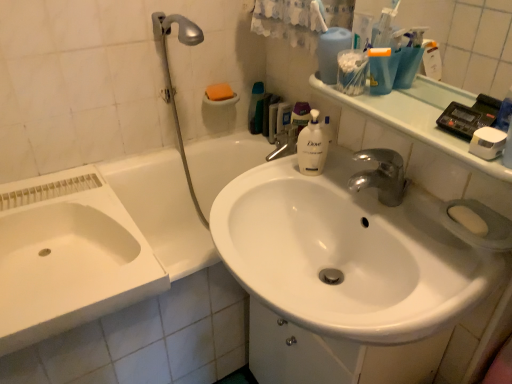
What do you see at coordinates (418, 116) in the screenshot? I see `white glossy sink at upper right` at bounding box center [418, 116].

In the scene shown: Measure the distance between white glossy sink at upper right and camera.

The distance of white glossy sink at upper right from camera is 69.15 centimeters.

What do you see at coordinates (170, 79) in the screenshot? The image size is (512, 384). I see `silver metallic shower head at upper left` at bounding box center [170, 79].

How much space does white glossy sink at lower left, which appears as the first sink when viewed from the left, occupy horizontally?

27.57 inches.

Describe the element at coordinates (68, 256) in the screenshot. I see `white glossy sink at lower left, which appears as the first sink when viewed from the left` at that location.

Where is `white fabric bath towel at upper center`? white fabric bath towel at upper center is located at coordinates (287, 22).

From the image's perspective, is white glossy sink at center, the 2th sink from the left, below orange sponge at upper center, the 1th soap positioned from the top?

Yes.

From a real-world perspective, is white glossy sink at center, arranged as the 1th sink when viewed from the right, under orange sponge at upper center, the first soap positioned from the left?

Correct, in the physical world, white glossy sink at center, arranged as the 1th sink when viewed from the right, is lower than orange sponge at upper center, the first soap positioned from the left.

Would you consider white glossy sink at upper right to be distant from white glossy bathtub at lower left?

No.

Considering the relative sizes of white glossy sink at upper right and white glossy bathtub at lower left in the image provided, is white glossy sink at upper right wider than white glossy bathtub at lower left?

Incorrect, the width of white glossy sink at upper right does not surpass that of white glossy bathtub at lower left.

Would you say white glossy sink at upper right is to the left or to the right of white glossy bathtub at lower left in the picture?

Based on their positions, white glossy sink at upper right is located to the right of white glossy bathtub at lower left.

From the picture: Is silver metallic shower head at upper left looking in the opposite direction of white glossy sink at center, the 2th sink from the left?

No, white glossy sink at center, the 2th sink from the left, is not at the back of silver metallic shower head at upper left.

Can you confirm if silver metallic shower head at upper left is positioned to the right of white glossy sink at center, arranged as the 1th sink when viewed from the right?

No.

Consider the image. In terms of height, does silver metallic shower head at upper left look taller or shorter compared to white glossy sink at center, the 2th sink from the left?

Considering their sizes, silver metallic shower head at upper left has more height than white glossy sink at center, the 2th sink from the left.

From a real-world perspective, which object rests below the other?

white glossy sink at center, arranged as the 1th sink when viewed from the right, is physically lower.

Considering the points (214, 97) and (478, 277), which point is in front, point (214, 97) or point (478, 277)?

The point (478, 277) is closer.

Is orange sponge at upper center, the first soap positioned from the left, placed right next to white glossy sink at center, arranged as the 1th sink when viewed from the right?

orange sponge at upper center, the first soap positioned from the left, is not next to white glossy sink at center, arranged as the 1th sink when viewed from the right, and they're not touching.

Is orange sponge at upper center, the second soap from the front, in front of white glossy sink at center, the 2th sink from the left?

No, the depth of orange sponge at upper center, the second soap from the front, is greater than that of white glossy sink at center, the 2th sink from the left.

Considering the relative sizes of silver metallic shower head at upper left and orange sponge at upper center, the 1th soap positioned from the top, in the image provided, is silver metallic shower head at upper left shorter than orange sponge at upper center, the 1th soap positioned from the top,?

No.

Is silver metallic shower head at upper left facing towards orange sponge at upper center, the second soap from the front?

No, silver metallic shower head at upper left is not aimed at orange sponge at upper center, the second soap from the front.

Where is `soap behind the silver metallic shower head at upper left`? soap behind the silver metallic shower head at upper left is located at coordinates (219, 92).

Considering the sizes of silver metallic shower head at upper left and orange sponge at upper center, the first soap positioned from the back, in the image, is silver metallic shower head at upper left wider or thinner than orange sponge at upper center, the first soap positioned from the back,?

In the image, silver metallic shower head at upper left appears to be wider than orange sponge at upper center, the first soap positioned from the back.

From a real-world perspective, which is physically above, white fabric bath towel at upper center or white glossy bathtub at lower left?

From a 3D spatial view, white fabric bath towel at upper center is above.

The height and width of the screenshot is (384, 512). What are the coordinates of `bath on the left of white fabric bath towel at upper center` in the screenshot? It's located at (115, 270).

Does white fabric bath towel at upper center have a lesser height compared to white glossy bathtub at lower left?

Indeed, white fabric bath towel at upper center has a lesser height compared to white glossy bathtub at lower left.

Is point (282, 32) closer or farther from the camera than point (152, 292)?

Clearly, point (282, 32) is more distant from the camera than point (152, 292).

From a real-world perspective, is white plastic toothbrush at upper center over clear plastic container at upper right?

Yes, from a real-world perspective, white plastic toothbrush at upper center is on top of clear plastic container at upper right.

Is white plastic toothbrush at upper center aimed at clear plastic container at upper right?

No, white plastic toothbrush at upper center does not turn towards clear plastic container at upper right.

The height and width of the screenshot is (384, 512). Identify the location of mouthwash below the white plastic toothbrush at upper center (from a real-world perspective). (351, 71).

Which object is positioned more to the left, white plastic toothbrush at upper center or clear plastic container at upper right?

white plastic toothbrush at upper center is more to the left.

Locate an element on the screen. This screenshot has height=384, width=512. sink on the right of orange sponge at upper center, which ranks as the second soap in bottom-to-top order is located at coordinates point(348,253).

Locate an element on the screen. The image size is (512, 384). counter top in front of the white glossy bathtub at lower left is located at coordinates (418, 116).

From the picture: Based on their spatial positions, is silver metallic shower head at upper left or orange sponge at upper center, which is the second soap from right to left, further from white glossy bathtub at lower left?

orange sponge at upper center, which is the second soap from right to left.

From the image, which object appears to be nearer to silver metallic shower head at upper left, white glossy sink at lower left, which is counted as the 2th sink, starting from the right, or white glossy sink at upper right?

The object closer to silver metallic shower head at upper left is white glossy sink at lower left, which is counted as the 2th sink, starting from the right.

Which object lies nearer to the anchor point silver metallic shower head at upper left, green plastic bottle at upper center, which is counted as the 1th cleaning product, starting from the back, or white glossy bathtub at lower left?

white glossy bathtub at lower left lies closer to silver metallic shower head at upper left than the other object.

Which object lies nearer to the anchor point white glossy sink at center, the 2th sink from the left, white glossy bathtub at lower left or white glossy sink at upper right?

Based on the image, white glossy sink at upper right appears to be nearer to white glossy sink at center, the 2th sink from the left.

Looking at the image, which one is located further to white fabric bath towel at upper center, white matte liquid soap at center, the 1th cleaning product when ordered from front to back, or white glossy bathtub at lower left?

white glossy bathtub at lower left is positioned further to the anchor white fabric bath towel at upper center.

Based on their spatial positions, is white matte liquid soap at center, which is the 2th cleaning product from top to bottom, or yellow matte soap at right, marked as the 1th soap in a right-to-left arrangement, closer to green plastic bottle at upper center, which is the first cleaning product in top-to-bottom order?

Among the two, white matte liquid soap at center, which is the 2th cleaning product from top to bottom, is located nearer to green plastic bottle at upper center, which is the first cleaning product in top-to-bottom order.

Consider the image. Considering their positions, is clear plastic container at upper right positioned closer to orange sponge at upper center, which is the second soap from right to left, than yellow matte soap at right, arranged as the second soap when viewed from the left?

Based on the image, clear plastic container at upper right appears to be nearer to orange sponge at upper center, which is the second soap from right to left.

From the image, which object appears to be farther from orange sponge at upper center, which is the second soap from right to left, white glossy sink at upper right or white glossy bathtub at lower left?

The object further to orange sponge at upper center, which is the second soap from right to left, is white glossy sink at upper right.

Find the location of `soap located between white glossy sink at upper right and white matte liquid soap at center, arranged as the 2th cleaning product when viewed from the left, in the depth direction`. soap located between white glossy sink at upper right and white matte liquid soap at center, arranged as the 2th cleaning product when viewed from the left, in the depth direction is located at coordinates (468, 219).

Image resolution: width=512 pixels, height=384 pixels. Identify the location of sink between yellow matte soap at right, marked as the 1th soap in a right-to-left arrangement, and green plastic bottle at upper center, which is counted as the 1th cleaning product, starting from the back, in the front-back direction. (68, 256).

You are a GUI agent. You are given a task and a screenshot of the screen. Output one action in this format:
    pyautogui.click(x=<x>, y=<y>)
    Task: Click on the cleaning product positioned between white plastic toothbrush at upper center and green plastic bottle at upper center, the 2th cleaning product positioned from the right, from near to far
    
    Given the screenshot: What is the action you would take?
    pyautogui.click(x=312, y=146)

At what (x,y) coordinates should I click in order to perform the action: click on shower between white matte liquid soap at center, positioned as the second cleaning product in back-to-front order, and green plastic bottle at upper center, which is counted as the 1th cleaning product, starting from the left, in the front-back direction. Please return your answer as a coordinate pair (x, y). Looking at the image, I should click on (170, 79).